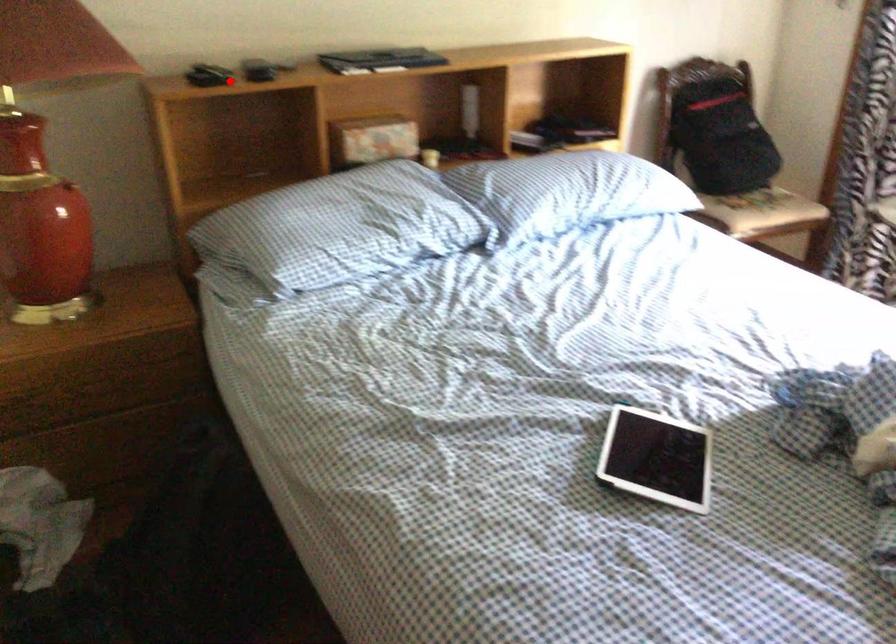
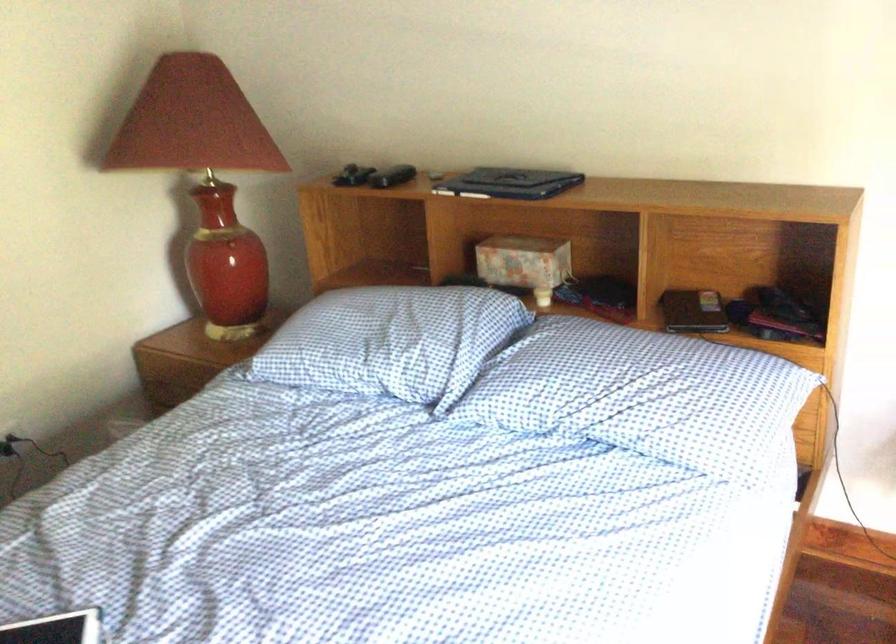
The point at the highlighted location is marked in the first image. Where is the corresponding point in the second image?

(352, 176)